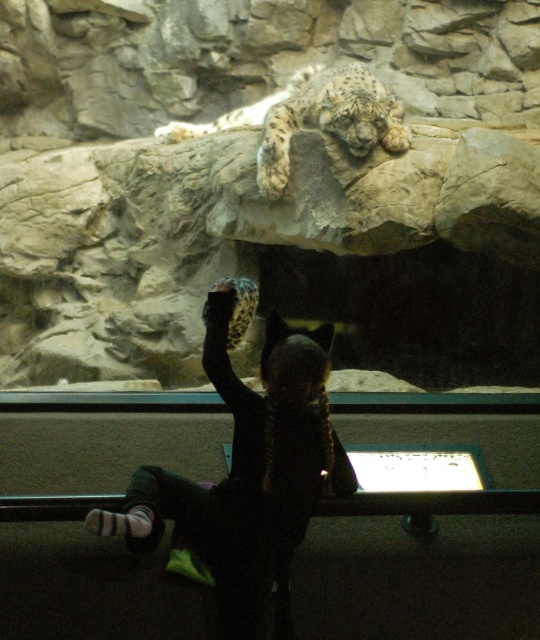
Question: Which of the following is the closest to the observer?

Choices:
 (A) (313, 125)
 (B) (244, 611)

Answer: (B)

Question: Is dark fur coat at center smaller than white fur snow leopard at upper center?

Choices:
 (A) yes
 (B) no

Answer: (A)

Question: Is dark fur coat at center further to the viewer compared to white fur snow leopard at upper center?

Choices:
 (A) no
 (B) yes

Answer: (A)

Question: Which object appears farthest from the camera in this image?

Choices:
 (A) dark fur coat at center
 (B) white fur snow leopard at upper center

Answer: (B)

Question: Which point appears farthest from the camera in this image?

Choices:
 (A) (271, 481)
 (B) (357, 64)

Answer: (B)

Question: Is dark fur coat at center above white fur snow leopard at upper center?

Choices:
 (A) no
 (B) yes

Answer: (A)